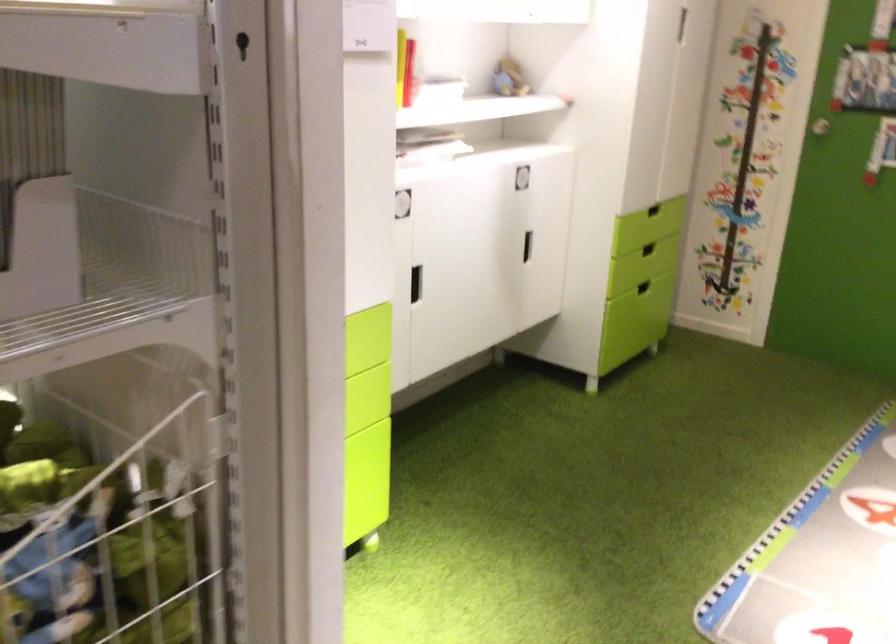
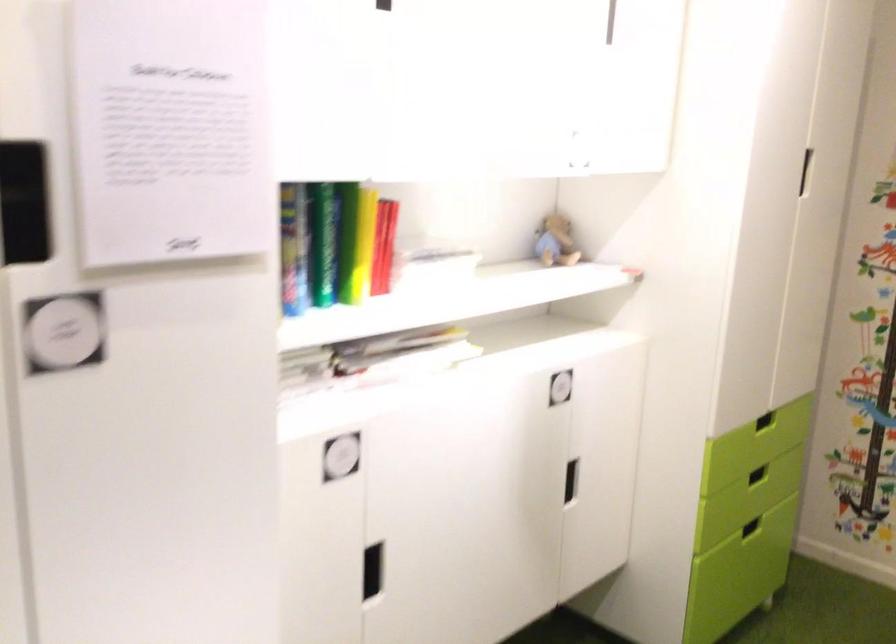
Question: The first image is from the beginning of the video and the second image is from the end. How did the camera likely rotate when shooting the video?

Choices:
 (A) Left
 (B) Right
 (C) Up
 (D) Down

Answer: (C)